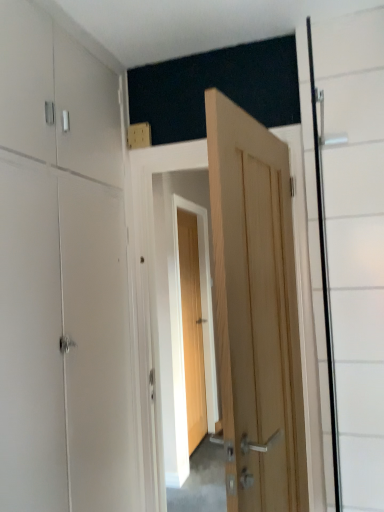
The width and height of the screenshot is (384, 512). I want to click on wooden door at center, which is the 1th door in back-to-front order, so click(x=192, y=328).

In order to face natural wood door at center, acting as the first door starting from the front, should I rotate leftwards or rightwards?

To align with it, rotate right about 9.850°.

Where is `transparent glass door at right`? This screenshot has height=512, width=384. transparent glass door at right is located at coordinates (356, 241).

What do you see at coordinates (65, 277) in the screenshot?
I see `white matte cabinet at left` at bounding box center [65, 277].

Find the location of `white matte cabinet at left`. white matte cabinet at left is located at coordinates (65, 277).

Image resolution: width=384 pixels, height=512 pixels. What are the coordinates of `wooden door at center, which is the 1th door in back-to-front order` in the screenshot? It's located at (192, 328).

Are wooden door at center, which is the 1th door in back-to-front order, and transparent glass door at right far apart?

Yes.

Considering the points (179, 248) and (368, 84), which point is behind, point (179, 248) or point (368, 84)?

Point (179, 248)

Considering the sizes of wooden door at center, which appears as the 2th door when viewed from the front, and natural wood door at center, acting as the first door starting from the front, in the image, is wooden door at center, which appears as the 2th door when viewed from the front, wider or thinner than natural wood door at center, acting as the first door starting from the front,?

Clearly, wooden door at center, which appears as the 2th door when viewed from the front, has less width compared to natural wood door at center, acting as the first door starting from the front.

Would you say wooden door at center, which is the 1th door in back-to-front order, is outside natural wood door at center, acting as the first door starting from the front?

Yes, wooden door at center, which is the 1th door in back-to-front order, is not within natural wood door at center, acting as the first door starting from the front.

Does wooden door at center, which appears as the 2th door when viewed from the front, have a lesser height compared to natural wood door at center, acting as the second door starting from the back?

Incorrect, the height of wooden door at center, which appears as the 2th door when viewed from the front, does not fall short of that of natural wood door at center, acting as the second door starting from the back.

What's the angular difference between wooden door at center, which is the 1th door in back-to-front order, and natural wood door at center, acting as the second door starting from the back,'s facing directions?

The angle between the facing direction of wooden door at center, which is the 1th door in back-to-front order, and the facing direction of natural wood door at center, acting as the second door starting from the back, is 168 degrees.

Locate an element on the screen. dresser that is under the transparent glass door at right (from a real-world perspective) is located at coordinates (65, 277).

Considering the sizes of objects white matte cabinet at left and transparent glass door at right in the image provided, who is thinner, white matte cabinet at left or transparent glass door at right?

transparent glass door at right.

Based on the photo, is white matte cabinet at left spatially inside transparent glass door at right, or outside of it?

white matte cabinet at left is not enclosed by transparent glass door at right.

You are a GUI agent. You are given a task and a screenshot of the screen. Output one action in this format:
    pyautogui.click(x=<x>, y=<y>)
    Task: Click on the glass door that is above the natural wood door at center, acting as the second door starting from the back (from the image's perspective)
    The width and height of the screenshot is (384, 512).
    Given the screenshot: What is the action you would take?
    pyautogui.click(x=356, y=241)

From the image's perspective, which one is positioned lower, transparent glass door at right or natural wood door at center, acting as the second door starting from the back?

natural wood door at center, acting as the second door starting from the back, from the image's perspective.

From a real-world perspective, who is located lower, transparent glass door at right or natural wood door at center, acting as the second door starting from the back?

natural wood door at center, acting as the second door starting from the back, is physically lower.

Does transparent glass door at right come in front of natural wood door at center, acting as the first door starting from the front?

That is False.

The height and width of the screenshot is (512, 384). In order to click on glass door that is above the natural wood door at center, acting as the first door starting from the front (from the image's perspective) in this screenshot , I will do `click(356, 241)`.

Consider the image. Considering the sizes of natural wood door at center, acting as the first door starting from the front, and transparent glass door at right in the image, is natural wood door at center, acting as the first door starting from the front, wider or thinner than transparent glass door at right?

natural wood door at center, acting as the first door starting from the front, is wider than transparent glass door at right.

From the image's perspective, which one is positioned lower, natural wood door at center, acting as the second door starting from the back, or transparent glass door at right?

natural wood door at center, acting as the second door starting from the back, is shown below in the image.

Based on their sizes in the image, would you say natural wood door at center, acting as the second door starting from the back, is bigger or smaller than transparent glass door at right?

natural wood door at center, acting as the second door starting from the back, is bigger than transparent glass door at right.

Is point (0, 70) positioned before point (279, 402)?

Yes, it is.

Does white matte cabinet at left touch natural wood door at center, acting as the second door starting from the back?

There is a gap between white matte cabinet at left and natural wood door at center, acting as the second door starting from the back.

Looking at this image, based on their positions, is white matte cabinet at left located to the left or right of natural wood door at center, acting as the second door starting from the back?

white matte cabinet at left is positioned on natural wood door at center, acting as the second door starting from the back,'s left side.

The width and height of the screenshot is (384, 512). What are the coordinates of `dresser that appears above the natural wood door at center, acting as the second door starting from the back (from the image's perspective)` in the screenshot? It's located at (65, 277).

Looking at this image, from the image's perspective, which one is positioned higher, natural wood door at center, acting as the first door starting from the front, or wooden door at center, which is the 1th door in back-to-front order?

natural wood door at center, acting as the first door starting from the front, appears higher in the image.

Is natural wood door at center, acting as the first door starting from the front, aimed at wooden door at center, which appears as the 2th door when viewed from the front?

No, natural wood door at center, acting as the first door starting from the front, is not aimed at wooden door at center, which appears as the 2th door when viewed from the front.

Considering the relative positions of natural wood door at center, acting as the second door starting from the back, and wooden door at center, which appears as the 2th door when viewed from the front, in the image provided, is natural wood door at center, acting as the second door starting from the back, behind wooden door at center, which appears as the 2th door when viewed from the front,?

No, natural wood door at center, acting as the second door starting from the back, is closer to the viewer.

Where is `door located behind the transparent glass door at right`? This screenshot has width=384, height=512. door located behind the transparent glass door at right is located at coordinates (192, 328).

Locate an element on the screen. door on the left of natural wood door at center, acting as the first door starting from the front is located at coordinates (192, 328).

Estimate the real-world distances between objects in this image. Which object is closer to natural wood door at center, acting as the second door starting from the back, wooden door at center, which is the 1th door in back-to-front order, or transparent glass door at right?

transparent glass door at right is positioned closer to the anchor natural wood door at center, acting as the second door starting from the back.

From the image, which object appears to be nearer to white matte cabinet at left, natural wood door at center, acting as the first door starting from the front, or wooden door at center, which appears as the 2th door when viewed from the front?

natural wood door at center, acting as the first door starting from the front.

From the image, which object appears to be farther from transparent glass door at right, wooden door at center, which appears as the 2th door when viewed from the front, or white matte cabinet at left?

Based on the image, wooden door at center, which appears as the 2th door when viewed from the front, appears to be further to transparent glass door at right.

In the scene shown: When comparing their distances from white matte cabinet at left, does wooden door at center, which appears as the 2th door when viewed from the front, or transparent glass door at right seem further?

Among the two, wooden door at center, which appears as the 2th door when viewed from the front, is located further to white matte cabinet at left.

Consider the image. From the image, which object appears to be farther from natural wood door at center, acting as the second door starting from the back, transparent glass door at right or wooden door at center, which appears as the 2th door when viewed from the front?

wooden door at center, which appears as the 2th door when viewed from the front, is further to natural wood door at center, acting as the second door starting from the back.

When comparing their distances from transparent glass door at right, does white matte cabinet at left or wooden door at center, which appears as the 2th door when viewed from the front, seem further?

wooden door at center, which appears as the 2th door when viewed from the front, lies further to transparent glass door at right than the other object.

Considering their positions, is white matte cabinet at left positioned further to wooden door at center, which appears as the 2th door when viewed from the front, than natural wood door at center, acting as the second door starting from the back?

natural wood door at center, acting as the second door starting from the back, lies further to wooden door at center, which appears as the 2th door when viewed from the front, than the other object.

From the image, which object appears to be nearer to white matte cabinet at left, transparent glass door at right or wooden door at center, which is the 1th door in back-to-front order?

The object closer to white matte cabinet at left is transparent glass door at right.

I want to click on glass door between white matte cabinet at left and wooden door at center, which appears as the 2th door when viewed from the front, along the z-axis, so click(x=356, y=241).

In order to click on door positioned between white matte cabinet at left and wooden door at center, which is the 1th door in back-to-front order, from near to far in this screenshot , I will do `click(255, 312)`.

Where is `glass door between natural wood door at center, acting as the first door starting from the front, and wooden door at center, which is the 1th door in back-to-front order, along the z-axis`? glass door between natural wood door at center, acting as the first door starting from the front, and wooden door at center, which is the 1th door in back-to-front order, along the z-axis is located at coordinates (356, 241).